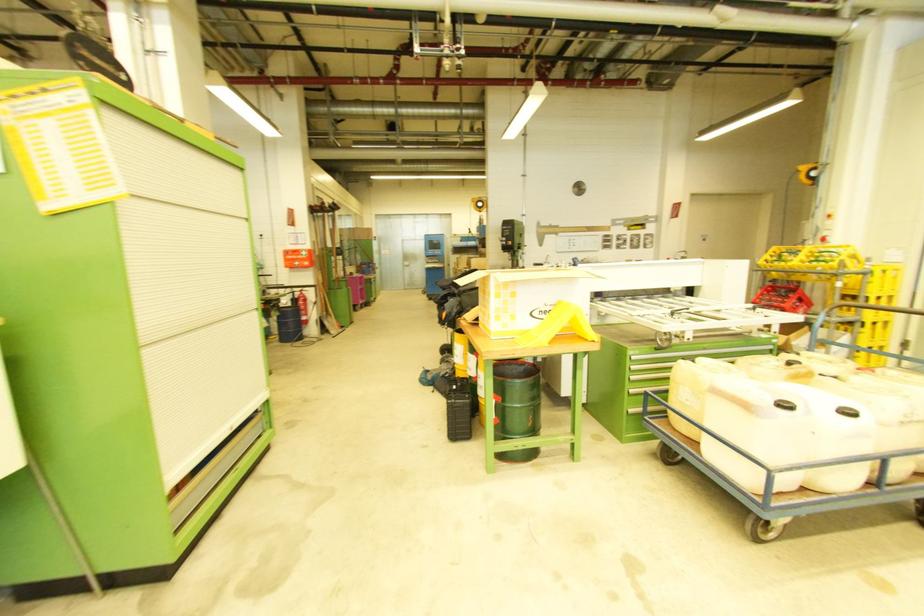
Locate an element on the screen. The image size is (924, 616). fire extinguisher lever is located at coordinates (302, 307).